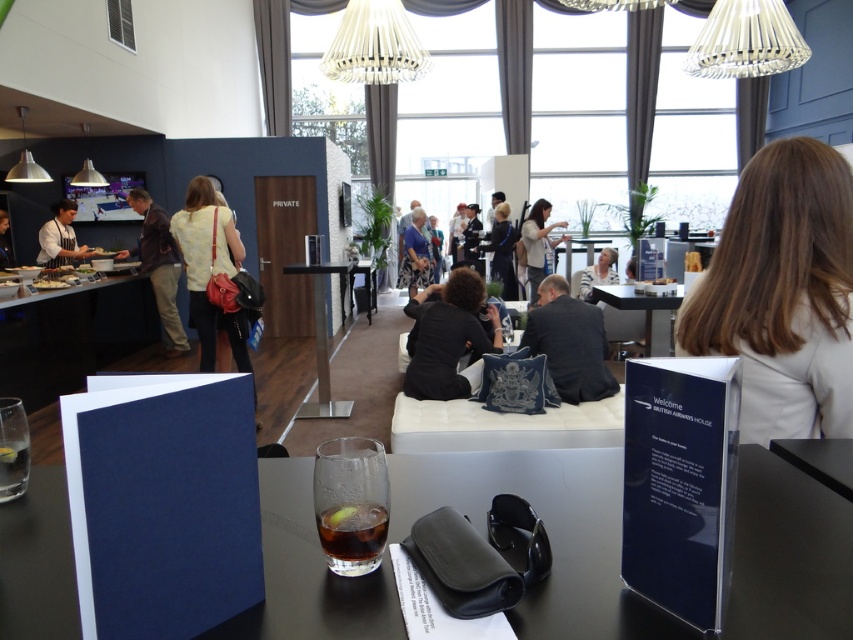
You are a traveler who just arrived at British Airways House. You see a light brown leather jacket at center and a smooth white cheese at center. Which item takes up more space on the table?

The light brown leather jacket at center is bigger than smooth white cheese at center, so it takes up more space on the table.

You are a guest at British Airways House and need to locate your belongings. You remember placing your dark blue suit at center and smooth white cheese at center on the table. Which item is closer to the right edge of the table?

The dark blue suit at center is to the right of the smooth white cheese at center, so the dark blue suit at center is closer to the right edge of the table.

You are standing in the lounge and want to place a 12 inch laptop on the matte black glass at center. Is there enough space for the laptop?

The matte black glass at center is 31.85 inches from the camera, so the distance is sufficient to place a 12 inch laptop.